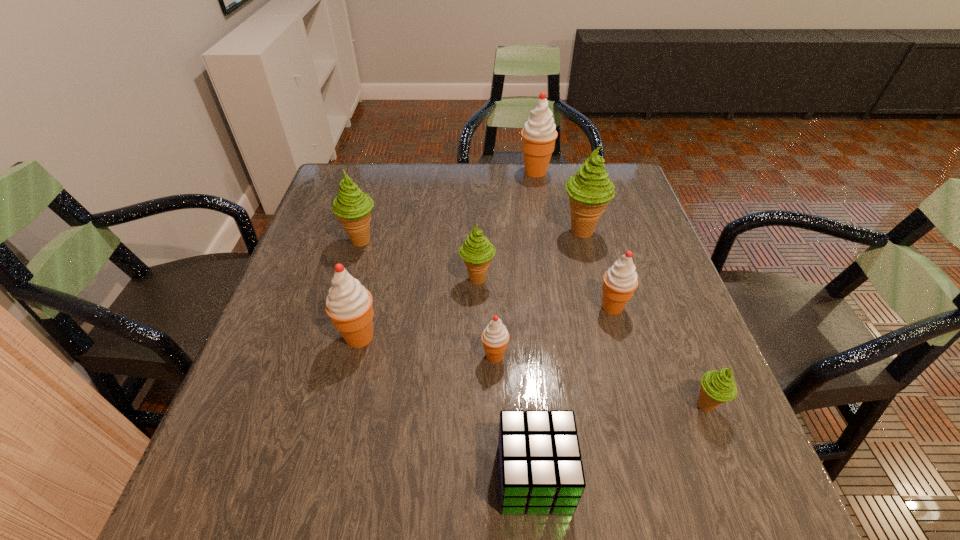
Locate an element on the screen. vacant space located 0.060m on the left of the third red icecream from right to left is located at coordinates (452, 356).

You are a GUI agent. You are given a task and a screenshot of the screen. Output one action in this format:
    pyautogui.click(x=<x>, y=<y>)
    Task: Click on the free spot located 0.250m on the left of the second nearest object
    The width and height of the screenshot is (960, 540).
    Given the screenshot: What is the action you would take?
    pyautogui.click(x=554, y=406)

Identify the location of free space located on the back of the cube. (520, 318).

The height and width of the screenshot is (540, 960). I want to click on object situated at the far edge, so click(x=539, y=133).

I want to click on object at the near edge, so click(540, 469).

Locate an element on the screen. The image size is (960, 540). free space at the far edge of the desktop is located at coordinates (391, 168).

Locate an element on the screen. Image resolution: width=960 pixels, height=540 pixels. free location at the left edge of the desktop is located at coordinates (340, 260).

The image size is (960, 540). In the image, there is a desktop. Find the location of `vacant space at the right edge`. vacant space at the right edge is located at coordinates [x=636, y=299].

Find the location of `vacant area at the far left corner of the desktop`. vacant area at the far left corner of the desktop is located at coordinates (372, 199).

In the image, there is a desktop. At what (x,y) coordinates should I click in order to perform the action: click on free region at the far right corner. Please return your answer as a coordinate pair (x, y). This screenshot has height=540, width=960. Looking at the image, I should click on (622, 169).